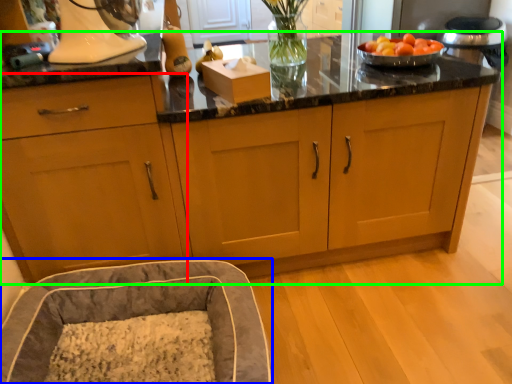
Question: Which object is the farthest from cabinetry (highlighted by a red box)? Choose among these: bean bag chair (highlighted by a blue box) or cabinetry (highlighted by a green box).

Choices:
 (A) bean bag chair
 (B) cabinetry

Answer: (A)